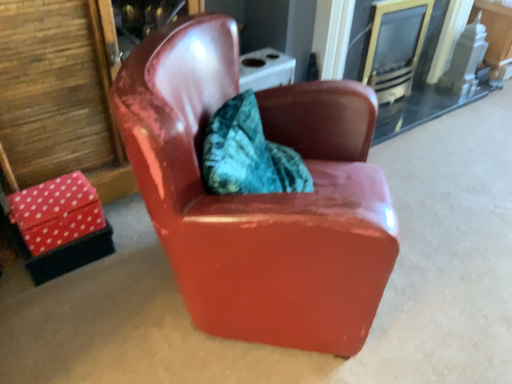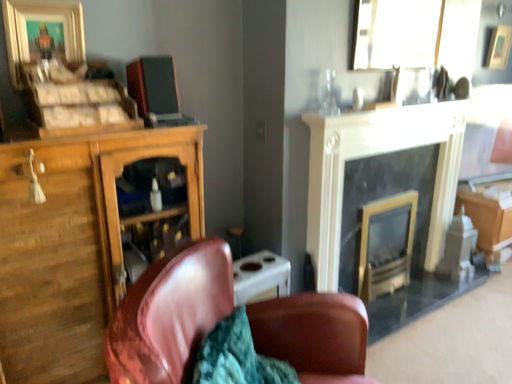
Question: How did the camera likely rotate when shooting the video?

Choices:
 (A) rotated downward
 (B) rotated upward

Answer: (B)